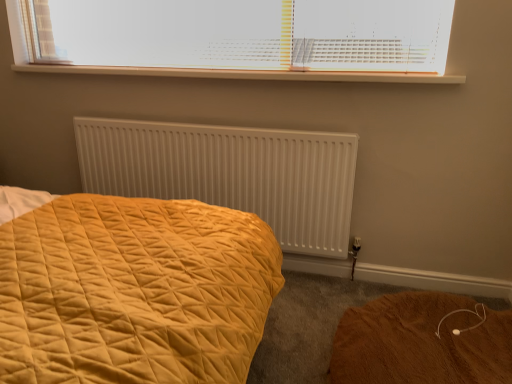
Question: Considering the relative sizes of white plastic blinds at upper center and white plastic radiator at upper center in the image provided, is white plastic blinds at upper center bigger than white plastic radiator at upper center?

Choices:
 (A) no
 (B) yes

Answer: (B)

Question: Is white plastic blinds at upper center positioned in front of white plastic radiator at upper center?

Choices:
 (A) yes
 (B) no

Answer: (A)

Question: Is white plastic blinds at upper center not within white plastic radiator at upper center?

Choices:
 (A) no
 (B) yes

Answer: (B)

Question: From the image's perspective, would you say white plastic blinds at upper center is shown under white plastic radiator at upper center?

Choices:
 (A) no
 (B) yes

Answer: (A)

Question: Considering the relative positions of white plastic blinds at upper center and white plastic radiator at upper center in the image provided, is white plastic blinds at upper center behind white plastic radiator at upper center?

Choices:
 (A) no
 (B) yes

Answer: (A)

Question: Is white plastic blinds at upper center with white plastic radiator at upper center?

Choices:
 (A) no
 (B) yes

Answer: (B)

Question: From the image's perspective, is brown fuzzy rug at lower right below white plastic radiator at upper center?

Choices:
 (A) no
 (B) yes

Answer: (B)

Question: Is brown fuzzy rug at lower right positioned before white plastic radiator at upper center?

Choices:
 (A) no
 (B) yes

Answer: (B)

Question: Considering the relative positions of brown fuzzy rug at lower right and white plastic radiator at upper center in the image provided, is brown fuzzy rug at lower right to the left of white plastic radiator at upper center from the viewer's perspective?

Choices:
 (A) yes
 (B) no

Answer: (B)

Question: From the image's perspective, does brown fuzzy rug at lower right appear higher than white plastic radiator at upper center?

Choices:
 (A) no
 (B) yes

Answer: (A)

Question: Is brown fuzzy rug at lower right wider than white plastic radiator at upper center?

Choices:
 (A) no
 (B) yes

Answer: (B)

Question: Is brown fuzzy rug at lower right far from white plastic radiator at upper center?

Choices:
 (A) yes
 (B) no

Answer: (A)

Question: Is white plastic blinds at upper center further to the viewer compared to brown fuzzy rug at lower right?

Choices:
 (A) no
 (B) yes

Answer: (B)